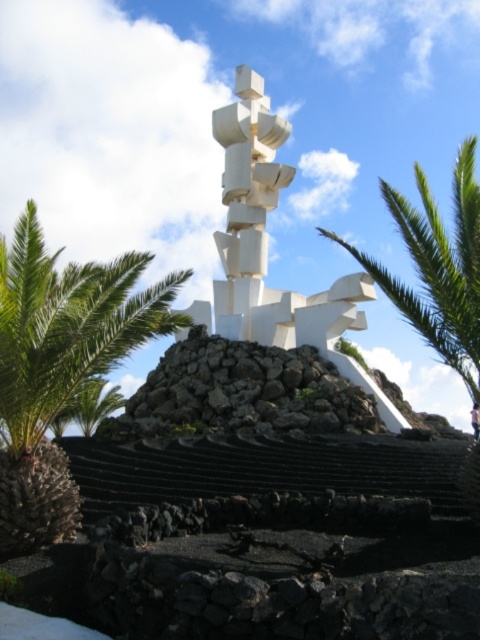
Question: Does green leafy palm at center have a smaller size compared to green leafy palm at right?

Choices:
 (A) no
 (B) yes

Answer: (B)

Question: Can you confirm if green leafy palm at center is positioned above green leafy palm at right?

Choices:
 (A) yes
 (B) no

Answer: (B)

Question: Which of the following is the closest to the observer?

Choices:
 (A) green leafy palm at center
 (B) green leafy palm at right

Answer: (A)

Question: Can you confirm if green leafy palm at center is positioned to the left of green leafy palm at right?

Choices:
 (A) yes
 (B) no

Answer: (A)